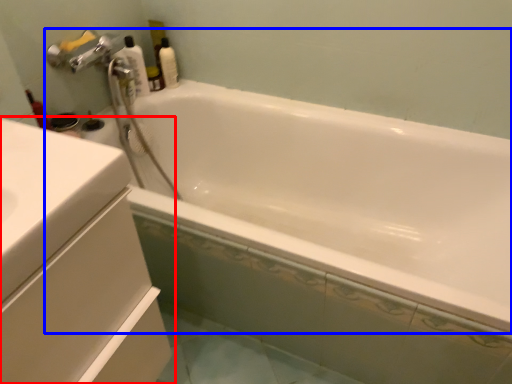
Question: Which point is closer to the camera, bathroom cabinet (highlighted by a red box) or bathtub (highlighted by a blue box)?

Choices:
 (A) bathroom cabinet
 (B) bathtub

Answer: (A)